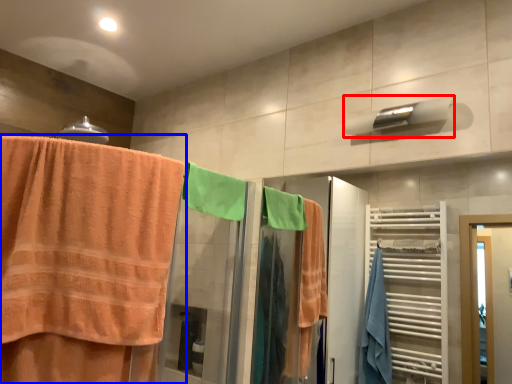
Question: Which object is closer to the camera taking this photo, towel bar (highlighted by a red box) or towel (highlighted by a blue box)?

Choices:
 (A) towel bar
 (B) towel

Answer: (B)